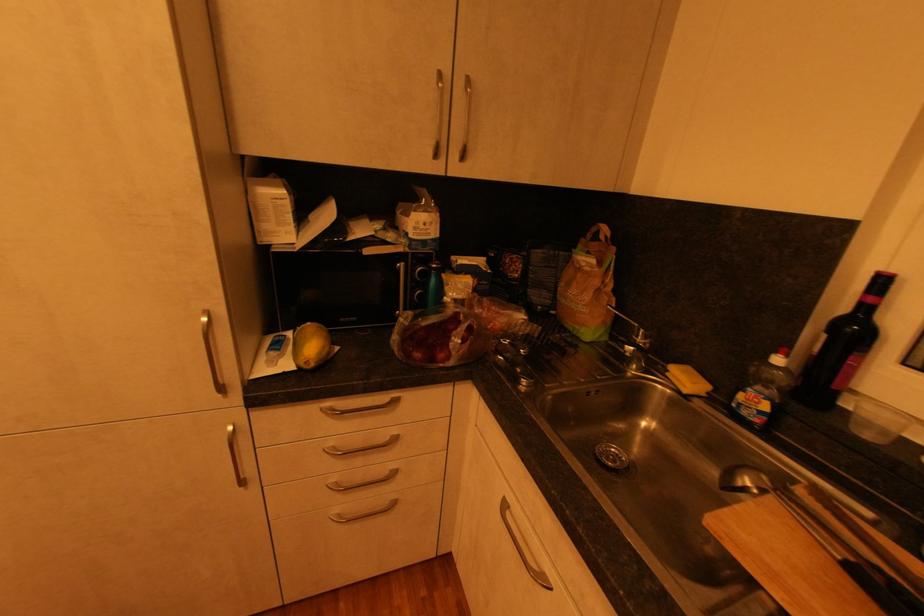
Find where to lift the metal ladle. Please return your answer as a coordinate pair (x, y).

(812, 551)